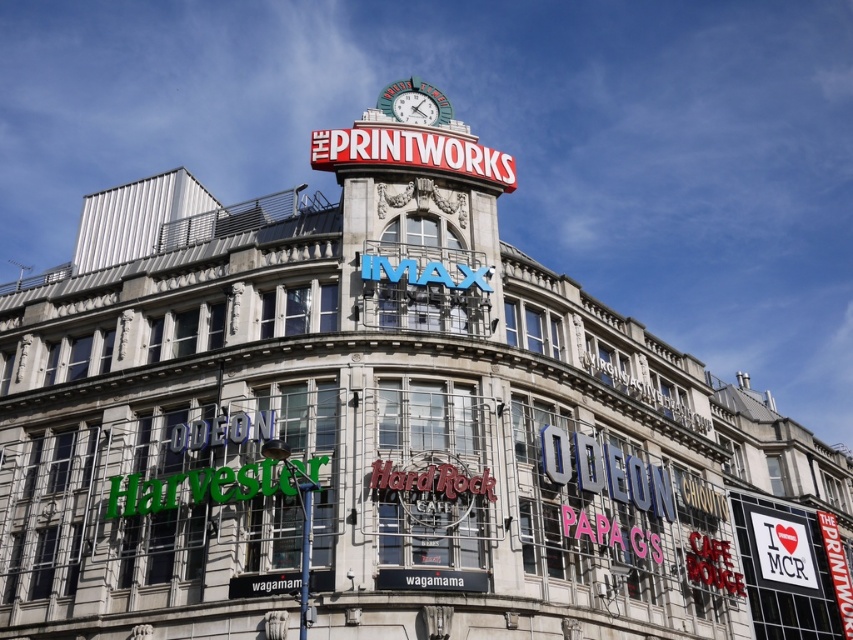
You are standing in front of The Printworks building and want to locate the IMAX cinema entrance. You see a red metallic sign at center top and a metallic clock face at center top. Which object is located lower on the building?

The red metallic sign at center top is positioned under the metallic clock face at center top, so it is located lower on the building.